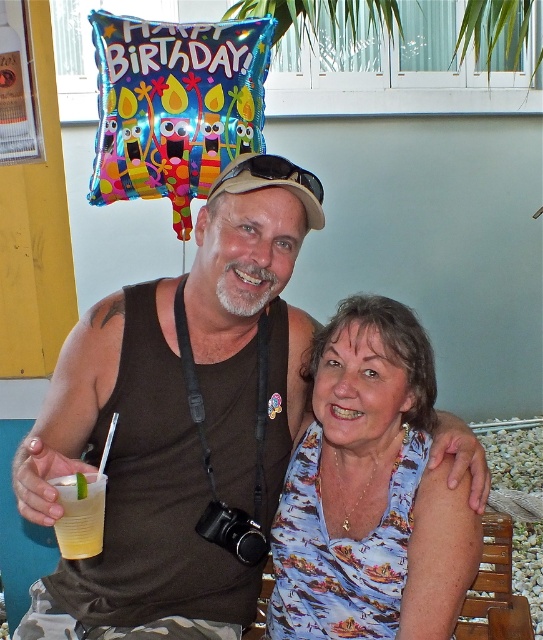
You are a photographer adjusting your camera settings. You notice the brown fabric tank top at center and the yellow translucent cup at lower left in your frame. Which object should you focus on first if you want to capture both in sharp focus, considering their sizes in the frame?

The brown fabric tank top at center is much taller than the yellow translucent cup at lower left, so focusing on the larger brown fabric tank top at center will ensure both are in focus as it occupies more space in the frame.

You are a photographer taking a photo of the scene. You want to ensure both the printed fabric blouse at center and the yellow translucent cup at lower left are clearly visible. Based on their positions, which object might be partially hidden and why?

The yellow translucent cup at lower left might be partially hidden because it is positioned behind the printed fabric blouse at center, which could block part of the cup from view.

You are a photographer trying to capture a closeup of the printed fabric blouse at center and the yellow translucent cup at lower left. Since you want to ensure both are in focus, you need to know which object is wider. Which one is wider?

The printed fabric blouse at center is wider than the yellow translucent cup at lower left according to the description.